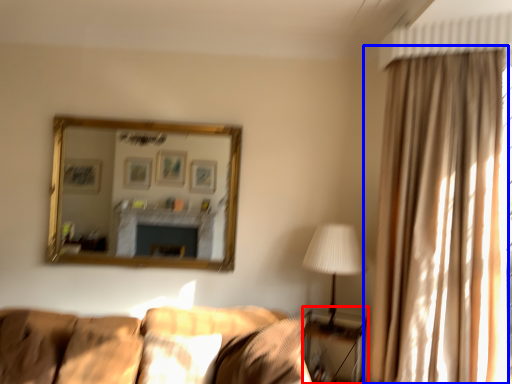
Question: Which point is closer to the camera, table (highlighted by a red box) or curtain (highlighted by a blue box)?

Choices:
 (A) table
 (B) curtain

Answer: (B)